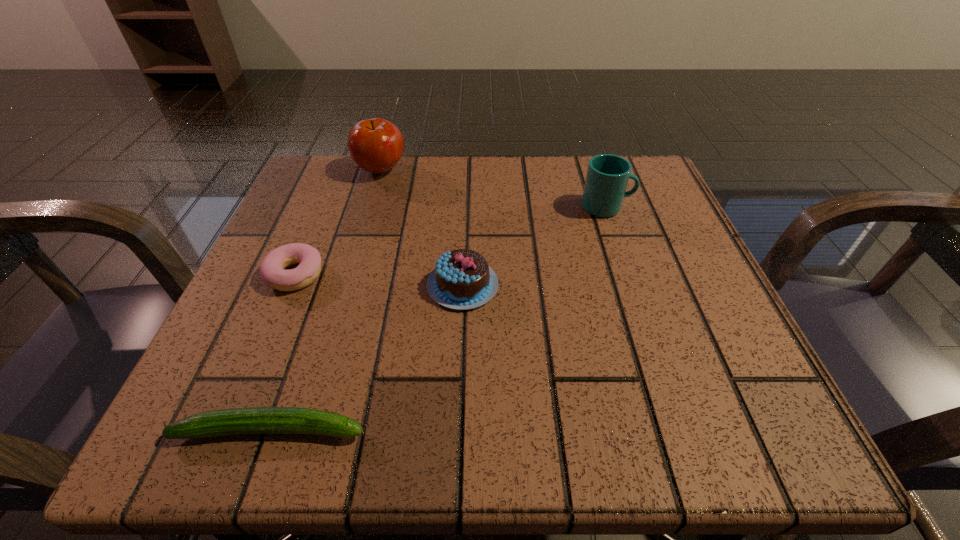
Locate an element on the screen. vacant space at the far right corner of the desktop is located at coordinates (646, 178).

This screenshot has height=540, width=960. In order to click on free spot between the rightmost object and the farthest object in this screenshot , I will do `click(493, 188)`.

Locate an element on the screen. The height and width of the screenshot is (540, 960). vacant region between the tallest object and the doughnut is located at coordinates (338, 222).

Locate an element on the screen. This screenshot has height=540, width=960. vacant area that lies between the doughnut and the third tallest object is located at coordinates (379, 280).

Find the location of a particular element. This screenshot has height=540, width=960. vacant area between the doughnut and the tallest object is located at coordinates (338, 222).

This screenshot has width=960, height=540. I want to click on vacant point located between the apple and the fourth nearest object, so click(493, 188).

This screenshot has height=540, width=960. Find the location of `vacant space that's between the third tallest object and the doughnut`. vacant space that's between the third tallest object and the doughnut is located at coordinates (379, 280).

Where is `free space between the third tallest object and the tallest object`? This screenshot has width=960, height=540. free space between the third tallest object and the tallest object is located at coordinates (421, 228).

You are a GUI agent. You are given a task and a screenshot of the screen. Output one action in this format:
    pyautogui.click(x=<x>, y=<y>)
    Task: Click on the free space between the cup and the apple
    
    Given the screenshot: What is the action you would take?
    pyautogui.click(x=493, y=188)

Image resolution: width=960 pixels, height=540 pixels. I want to click on empty space that is in between the second farthest object and the doughnut, so 451,241.